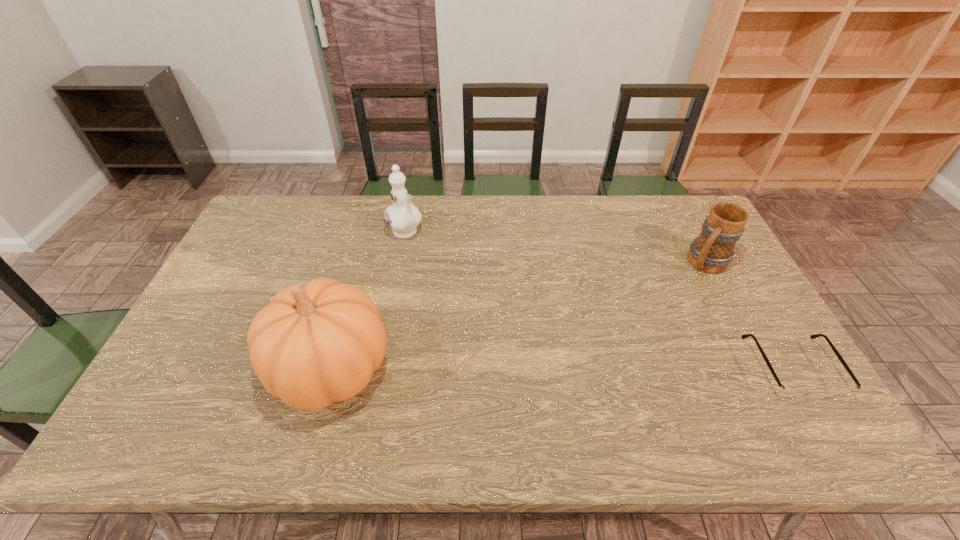
The width and height of the screenshot is (960, 540). In order to click on pumpkin in this screenshot , I will do `click(315, 344)`.

Where is `spectacles`? The height and width of the screenshot is (540, 960). spectacles is located at coordinates (785, 392).

Where is `mug`? The height and width of the screenshot is (540, 960). mug is located at coordinates (712, 251).

Image resolution: width=960 pixels, height=540 pixels. I want to click on the third tallest object, so click(712, 251).

You are a GUI agent. You are given a task and a screenshot of the screen. Output one action in this format:
    pyautogui.click(x=<x>, y=<y>)
    Task: Click on the farthest object
    This screenshot has width=960, height=540.
    Given the screenshot: What is the action you would take?
    pyautogui.click(x=402, y=217)

What are the coordinates of `vacant space situated on the back of the pumpkin` in the screenshot? It's located at (350, 296).

Identify the location of free location located on the side of the mug with the handle. (647, 332).

Find the location of `vacant space located on the side of the mug with the handle`. vacant space located on the side of the mug with the handle is located at coordinates (681, 293).

Identify the location of vacant space located 0.140m on the side of the mug with the handle. (675, 300).

This screenshot has width=960, height=540. What are the coordinates of `vacant area situated 0.360m at the spout of the chinaware` in the screenshot? It's located at 469,315.